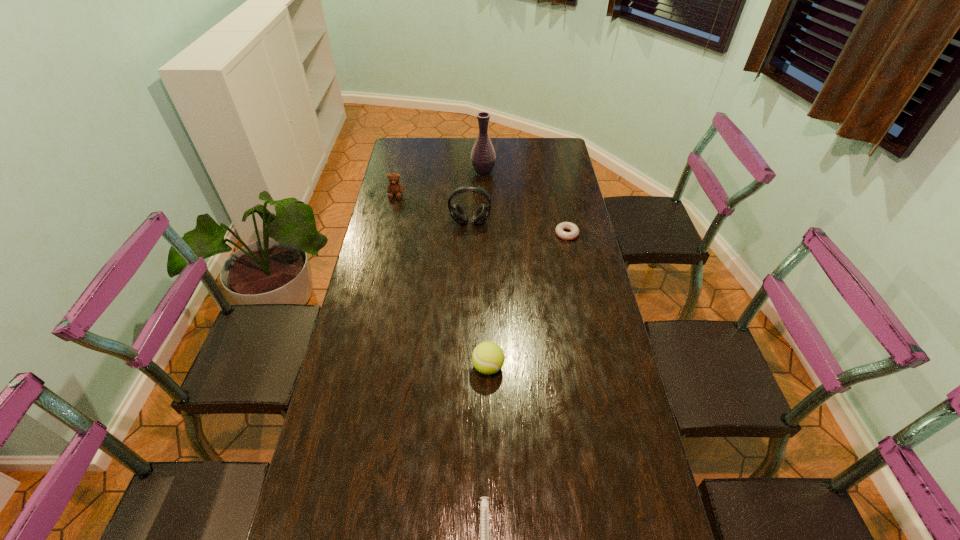
Identify the location of free region that satisfies the following two spatial constraints: 1. on the earcups of the fifth shortest object; 2. on the right side of the rightmost object. (469, 234).